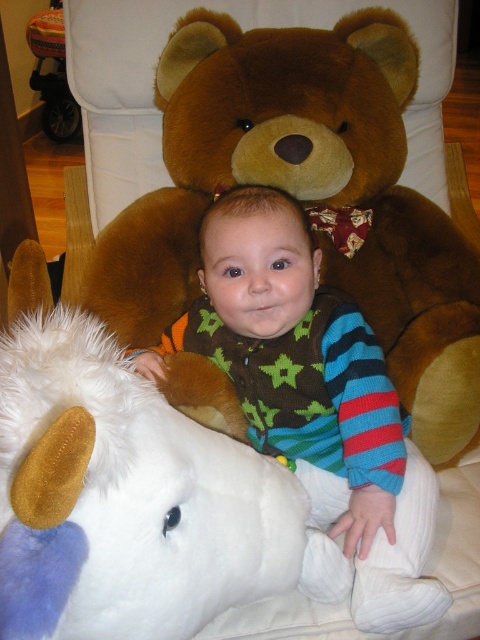
You are a parent trying to decide which toy to give to your child. You see the brown plush teddy bear at center and the white plush unicorn at lower left. Which one is bigger?

The brown plush teddy bear at center is larger in size than the white plush unicorn at lower left.

The child is sitting on a plush toy horse. Where is the brown plush teddy bear at center located in the image?

The brown plush teddy bear at center is located at point [305,196] in the image.

You are a photographer standing 5 feet away from the camera. You want to take a photo of the brown plush teddy bear at center. Can you move closer to the bear to get a better shot without moving the camera?

The brown plush teddy bear at center and camera are 3.35 feet apart from each other. Since you are standing 5 feet away from the camera, you can move closer to the bear by up to 1.65 feet to take the photo without moving the camera.